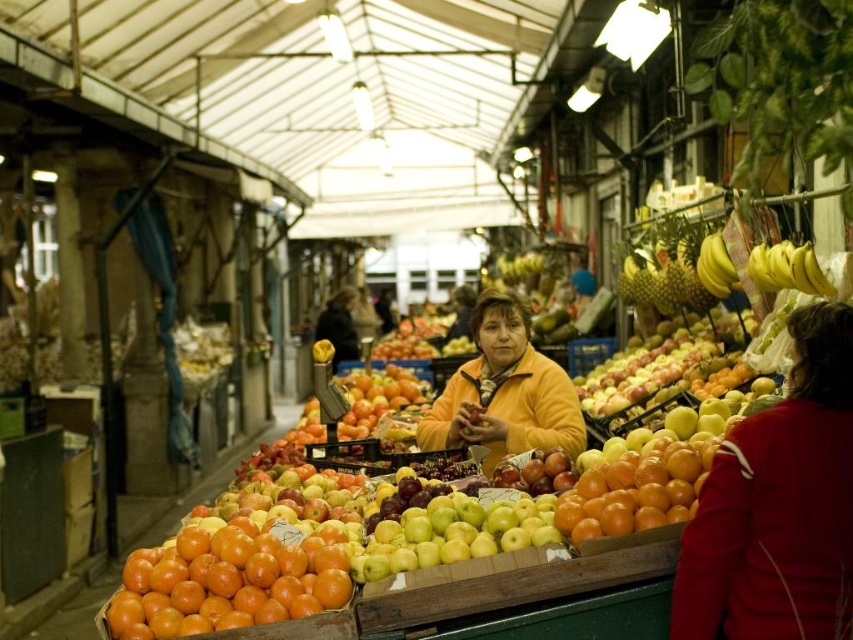
Looking at this image, you are a customer at the market and want to buy a jacket. You notice two fleece jackets available. The red fleece jacket at lower right and the orange fleece jacket at center. Which jacket is narrower in width?

The red fleece jacket at lower right is narrower in width than the orange fleece jacket at center.

You are a customer at the market and want to buy the wider oranges. Which ones should you choose between the glossy orange oranges at lower left and the shiny orange oranges at center?

The glossy orange oranges at lower left are wider than the shiny orange oranges at center, so you should choose the glossy orange oranges at lower left.